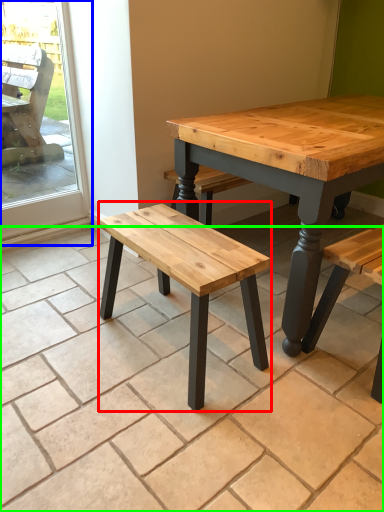
Question: Based on their relative distances, which object is nearer to stool (highlighted by a red box)? Choose from screen door (highlighted by a blue box) and tile (highlighted by a green box).

Choices:
 (A) screen door
 (B) tile

Answer: (B)